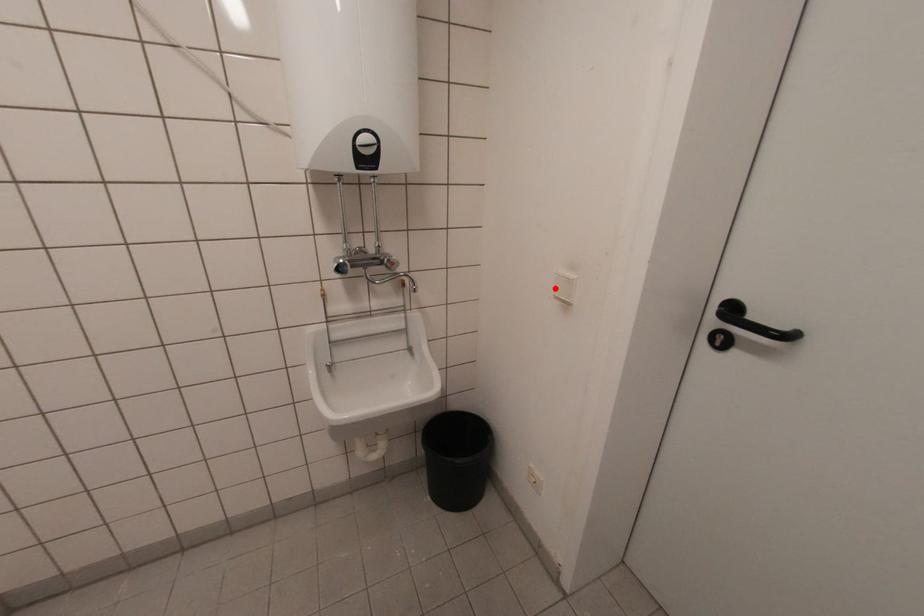
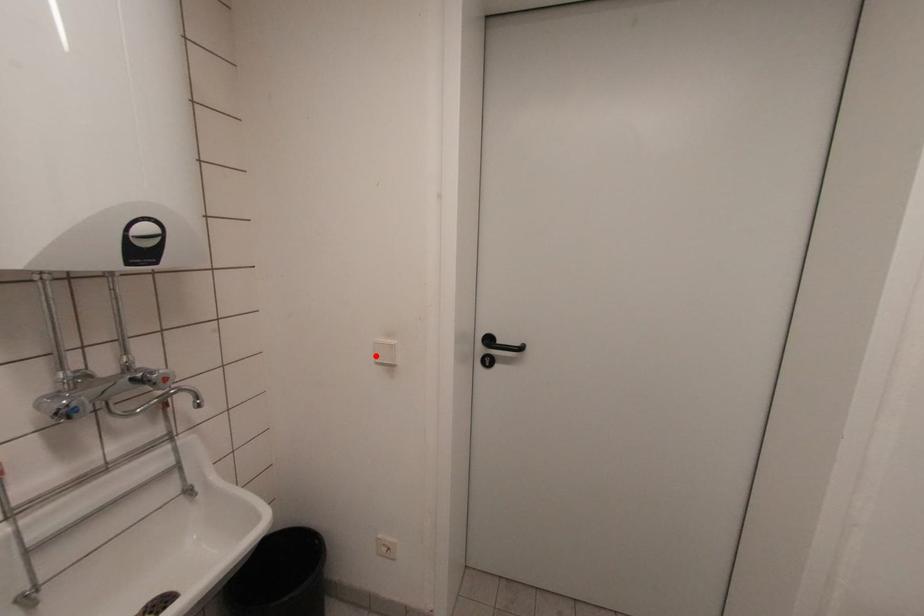
I am providing you with two images of the same scene from different viewpoints. A red point is marked on the first image and another point is marked on the second image. Is the marked point in image1 the same physical position as the marked point in image2?

Yes